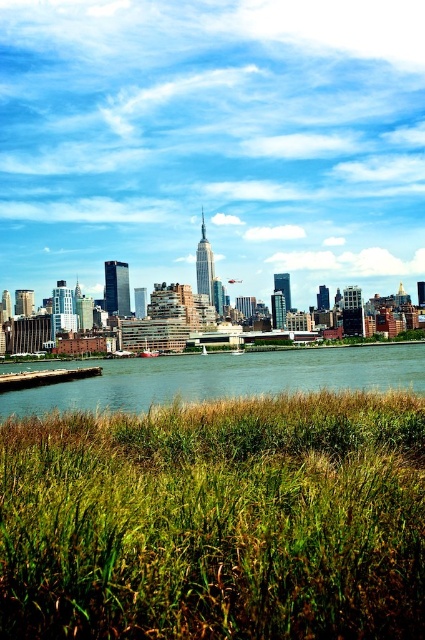
You are standing on the bank of the river looking at the scene. Which object, the blue sky at upper center or the green grassy field at lower center, occupies a larger vertical space in the image?

The blue sky at upper center is much taller than the green grassy field at lower center, so it occupies a larger vertical space.

Looking at the cityscape from across the river, you notice the blue sky at upper center and the green grassy field at lower center. Which of these two elements is positioned to the left of the other?

The blue sky at upper center is positioned to the left of the green grassy field at lower center.